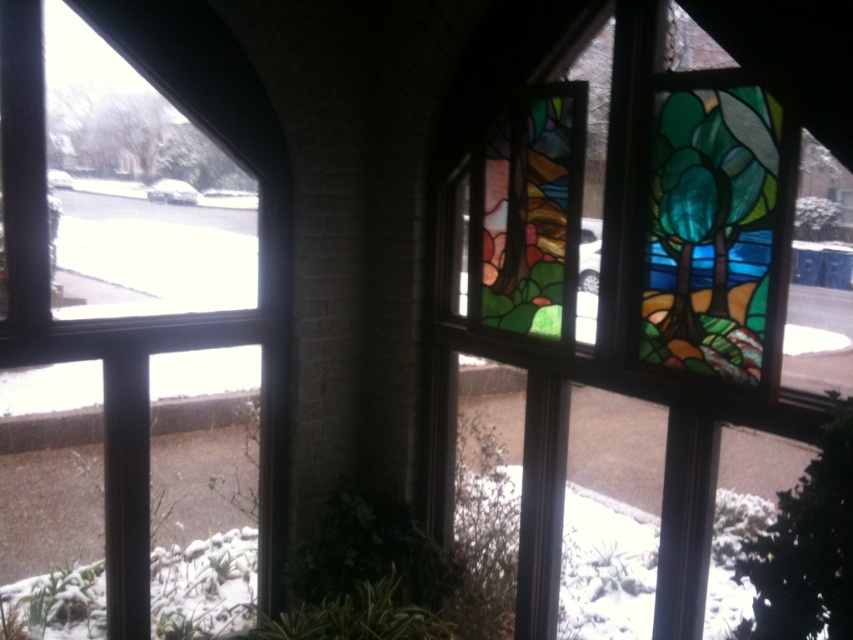
Is clear glass window at upper left in front of stained glass window at center?

No, it is not.

The height and width of the screenshot is (640, 853). I want to click on clear glass window at upper left, so click(138, 321).

Identify the location of clear glass window at upper left. (138, 321).